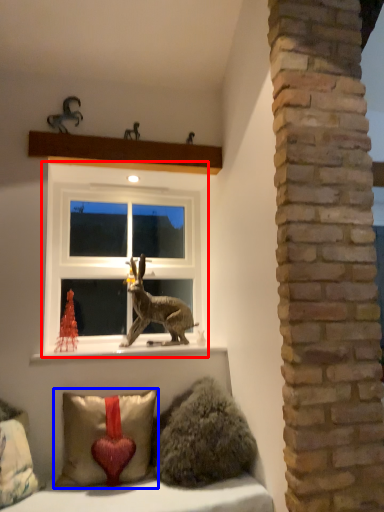
Question: Which of the following is the closest to the observer, window (highlighted by a red box) or pillow (highlighted by a blue box)?

Choices:
 (A) window
 (B) pillow

Answer: (B)